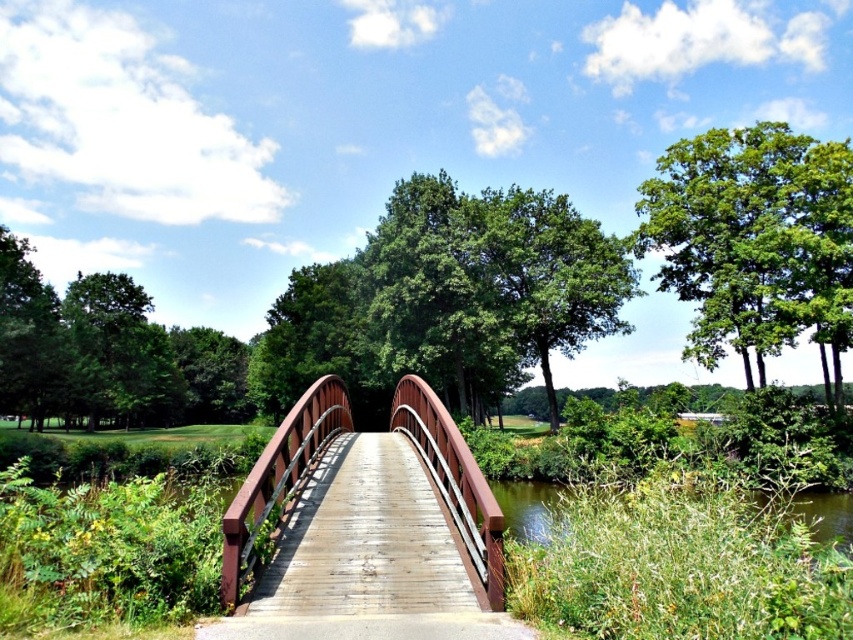
Question: Is wooden bridge at center in front of green leafy tree at upper right?

Choices:
 (A) yes
 (B) no

Answer: (A)

Question: Which point appears farthest from the camera in this image?

Choices:
 (A) (415, 548)
 (B) (715, 198)

Answer: (B)

Question: Among these objects, which one is nearest to the camera?

Choices:
 (A) wooden bridge at center
 (B) green leafy tree at upper right

Answer: (A)

Question: Can you confirm if wooden bridge at center is smaller than green leafy tree at upper right?

Choices:
 (A) no
 (B) yes

Answer: (B)

Question: Does wooden bridge at center have a lesser width compared to green leafy tree at upper right?

Choices:
 (A) no
 (B) yes

Answer: (B)

Question: Among these objects, which one is farthest from the camera?

Choices:
 (A) wooden bridge at center
 (B) green leafy tree at upper right

Answer: (B)